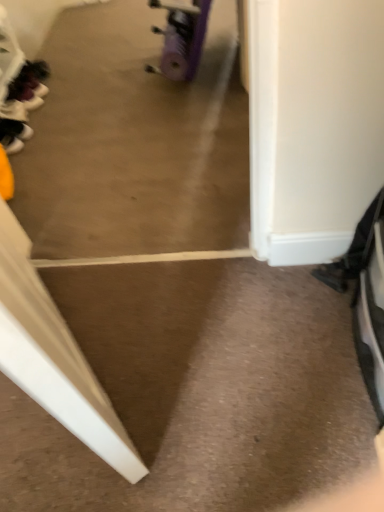
Find the location of a particular element. matte black shoe at left, which appears as the second footwear when ordered from the bottom is located at coordinates (14, 111).

From the picture: From a real-world perspective, which object rests below the other?

black matte shoe at left, the 1th footwear in the bottom-to-top sequence, is physically lower.

Consider the image. Which is nearer, (178, 52) or (3, 136)?

The point (178, 52) is more forward.

In terms of width, does purple rubber wheel at center look wider or thinner when compared to black matte shoe at left, placed as the first footwear when sorted from front to back?

Clearly, purple rubber wheel at center has less width compared to black matte shoe at left, placed as the first footwear when sorted from front to back.

Does purple rubber wheel at center touch black matte shoe at left, the 2th footwear positioned from the back?

No, purple rubber wheel at center is not with black matte shoe at left, the 2th footwear positioned from the back.

Is purple rubber wheel at center facing away from matte black shoe at left, which appears as the second footwear when ordered from the bottom?

No, purple rubber wheel at center's orientation is not away from matte black shoe at left, which appears as the second footwear when ordered from the bottom.

From a real-world perspective, who is located lower, purple rubber wheel at center or matte black shoe at left, the first footwear viewed from the top?

matte black shoe at left, the first footwear viewed from the top.

From the image's perspective, does purple rubber wheel at center appear lower than matte black shoe at left, which appears as the second footwear when viewed from the front?

No, from the image's perspective, purple rubber wheel at center is not beneath matte black shoe at left, which appears as the second footwear when viewed from the front.

Is purple rubber wheel at center not inside matte black shoe at left, the first footwear when ordered from back to front?

Absolutely, purple rubber wheel at center is external to matte black shoe at left, the first footwear when ordered from back to front.

Measure the distance between black matte shoe at left, the 1th footwear in the bottom-to-top sequence, and purple rubber wheel at center.

A distance of 30.51 inches exists between black matte shoe at left, the 1th footwear in the bottom-to-top sequence, and purple rubber wheel at center.

Who is smaller, black matte shoe at left, which is counted as the 2th footwear, starting from the top, or purple rubber wheel at center?

black matte shoe at left, which is counted as the 2th footwear, starting from the top.

From a real-world perspective, which is physically above, black matte shoe at left, placed as the first footwear when sorted from front to back, or purple rubber wheel at center?

In real-world perspective, purple rubber wheel at center is above.

Is black matte shoe at left, placed as the first footwear when sorted from front to back, positioned far away from purple rubber wheel at center?

They are positioned close to each other.

Is matte black shoe at left, the first footwear viewed from the top, positioned far away from purple rubber wheel at center?

No, there isn't a large distance between matte black shoe at left, the first footwear viewed from the top, and purple rubber wheel at center.

From a real-world perspective, starting from the purple rubber wheel at center, which footwear is the 2nd one below it? Please provide its 2D coordinates.

[(14, 111)]

Is matte black shoe at left, the first footwear viewed from the top, to the left or to the right of purple rubber wheel at center in the image?

matte black shoe at left, the first footwear viewed from the top, is positioned on purple rubber wheel at center's left side.

Considering the sizes of objects matte black shoe at left, the first footwear when ordered from back to front, and purple rubber wheel at center in the image provided, who is bigger, matte black shoe at left, the first footwear when ordered from back to front, or purple rubber wheel at center?

With larger size is purple rubber wheel at center.

From a real-world perspective, is matte black shoe at left, which appears as the second footwear when ordered from the bottom, beneath black matte shoe at left, placed as the first footwear when sorted from front to back?

Yes.

Which of these two, matte black shoe at left, the first footwear when ordered from back to front, or black matte shoe at left, which is counted as the 2th footwear, starting from the top, is bigger?

With larger size is black matte shoe at left, which is counted as the 2th footwear, starting from the top.

Is there a large distance between matte black shoe at left, which appears as the second footwear when viewed from the front, and black matte shoe at left, which is counted as the 2th footwear, starting from the top?

That's not correct — matte black shoe at left, which appears as the second footwear when viewed from the front, is a little close to black matte shoe at left, which is counted as the 2th footwear, starting from the top.

Is matte black shoe at left, the first footwear viewed from the top, to the left or to the right of black matte shoe at left, placed as the first footwear when sorted from front to back, in the image?

matte black shoe at left, the first footwear viewed from the top, is to the left of black matte shoe at left, placed as the first footwear when sorted from front to back.

Is point (15, 128) in front of point (1, 106)?

Yes, it is in front of point (1, 106).

From the image's perspective, relative to matte black shoe at left, the first footwear viewed from the top, is black matte shoe at left, which is counted as the 2th footwear, starting from the top, above or below?

Clearly, from the image's perspective, black matte shoe at left, which is counted as the 2th footwear, starting from the top, is below matte black shoe at left, the first footwear viewed from the top.

From the picture: Is black matte shoe at left, placed as the first footwear when sorted from front to back, turned away from matte black shoe at left, the first footwear when ordered from back to front?

black matte shoe at left, placed as the first footwear when sorted from front to back, does not have its back to matte black shoe at left, the first footwear when ordered from back to front.

Looking at their sizes, would you say black matte shoe at left, the 2th footwear positioned from the back, is wider or thinner than matte black shoe at left, the first footwear when ordered from back to front?

black matte shoe at left, the 2th footwear positioned from the back, is thinner than matte black shoe at left, the first footwear when ordered from back to front.

The height and width of the screenshot is (512, 384). Find the location of `the 1st footwear behind when counting from the purple rubber wheel at center`. the 1st footwear behind when counting from the purple rubber wheel at center is located at coordinates (15, 129).

Where is `wheel in front of the matte black shoe at left, which appears as the second footwear when ordered from the bottom`? wheel in front of the matte black shoe at left, which appears as the second footwear when ordered from the bottom is located at coordinates (181, 39).

Estimate the real-world distances between objects in this image. Which object is further from matte black shoe at left, the first footwear when ordered from back to front, black matte shoe at left, placed as the first footwear when sorted from front to back, or purple rubber wheel at center?

purple rubber wheel at center is positioned further to the anchor matte black shoe at left, the first footwear when ordered from back to front.

Considering their positions, is matte black shoe at left, the first footwear viewed from the top, positioned further to purple rubber wheel at center than black matte shoe at left, the 2th footwear positioned from the back?

matte black shoe at left, the first footwear viewed from the top, is further to purple rubber wheel at center.

From the image, which object appears to be nearer to black matte shoe at left, the 1th footwear in the bottom-to-top sequence, matte black shoe at left, the first footwear viewed from the top, or purple rubber wheel at center?

matte black shoe at left, the first footwear viewed from the top, lies closer to black matte shoe at left, the 1th footwear in the bottom-to-top sequence, than the other object.

Considering their positions, is purple rubber wheel at center positioned closer to black matte shoe at left, the 1th footwear in the bottom-to-top sequence, than matte black shoe at left, which appears as the second footwear when viewed from the front?

Among the two, matte black shoe at left, which appears as the second footwear when viewed from the front, is located nearer to black matte shoe at left, the 1th footwear in the bottom-to-top sequence.

Based on their spatial positions, is purple rubber wheel at center or black matte shoe at left, placed as the first footwear when sorted from front to back, further from matte black shoe at left, the first footwear when ordered from back to front?

The object further to matte black shoe at left, the first footwear when ordered from back to front, is purple rubber wheel at center.

Based on their spatial positions, is black matte shoe at left, the 1th footwear in the bottom-to-top sequence, or matte black shoe at left, the first footwear viewed from the top, further from purple rubber wheel at center?

The object further to purple rubber wheel at center is matte black shoe at left, the first footwear viewed from the top.

The height and width of the screenshot is (512, 384). Identify the location of footwear between matte black shoe at left, which appears as the second footwear when viewed from the front, and purple rubber wheel at center, in the horizontal direction. (15, 129).